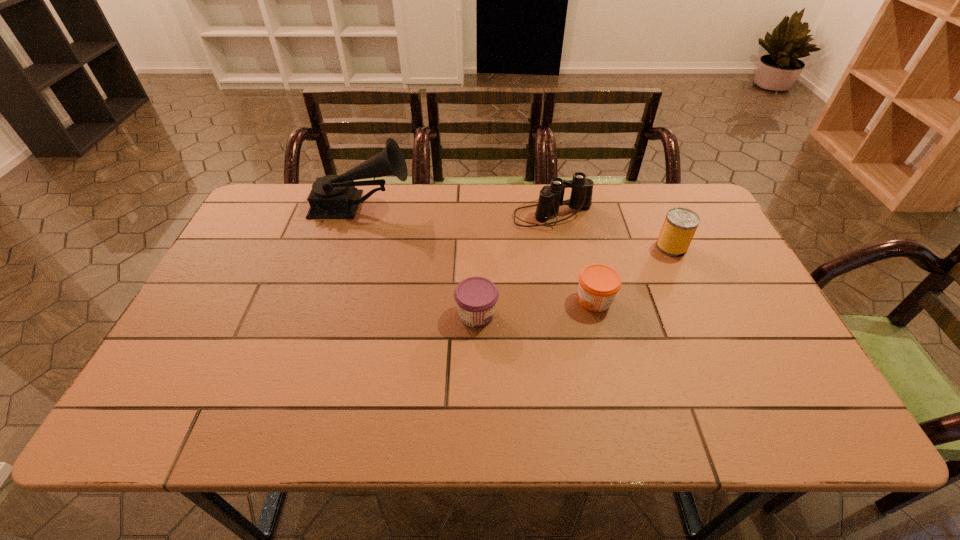
Find the location of `phonograph_record`. phonograph_record is located at coordinates (333, 196).

You are a GUI agent. You are given a task and a screenshot of the screen. Output one action in this format:
    pyautogui.click(x=<x>, y=<y>)
    Task: Click on the tallest object
    Image resolution: width=960 pixels, height=540 pixels.
    Given the screenshot: What is the action you would take?
    pyautogui.click(x=333, y=196)

This screenshot has width=960, height=540. What are the coordinates of `binoculars` in the screenshot? It's located at (551, 197).

You are a GUI agent. You are given a task and a screenshot of the screen. Output one action in this format:
    pyautogui.click(x=<x>, y=<y>)
    Task: Click on the can
    
    Given the screenshot: What is the action you would take?
    pyautogui.click(x=679, y=227)

In order to click on the third shortest object in this screenshot , I will do `click(679, 227)`.

The height and width of the screenshot is (540, 960). Find the location of `the left jam`. the left jam is located at coordinates (476, 297).

Identify the location of the right jam. This screenshot has width=960, height=540. (598, 284).

The width and height of the screenshot is (960, 540). Identify the location of free spot located 0.240m from the horn of the leftmost object. (486, 207).

This screenshot has height=540, width=960. In order to click on vacant area situated on the left of the binoculars in this screenshot , I will do `click(421, 215)`.

Identify the location of vacant space located 0.360m on the left of the rightmost object. (534, 247).